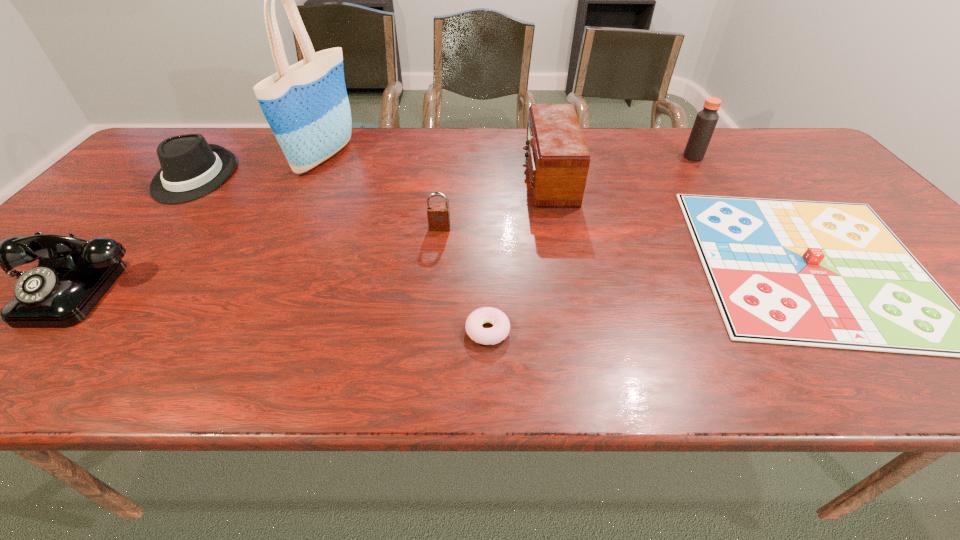
Where is `free space located 0.170m on the front-facing side of the radio receiver`? This screenshot has height=540, width=960. free space located 0.170m on the front-facing side of the radio receiver is located at coordinates (464, 178).

The image size is (960, 540). Identify the location of vacant space situated 0.050m on the front-facing side of the radio receiver. (507, 178).

At what (x,y) coordinates should I click in order to perform the action: click on free location located on the front-facing side of the radio receiver. Please return your answer as a coordinate pair (x, y). This screenshot has height=540, width=960. Looking at the image, I should click on (482, 178).

The width and height of the screenshot is (960, 540). In order to click on free region located 0.060m on the front-facing side of the padlock in this screenshot , I will do [438, 248].

Locate an element on the screen. This screenshot has width=960, height=540. free space located on the front-facing side of the fedora is located at coordinates (114, 272).

I want to click on vacant space positioned 0.300m on the left of the shortest object, so click(x=310, y=330).

The height and width of the screenshot is (540, 960). Find the location of `tote bag present at the far edge`. tote bag present at the far edge is located at coordinates (306, 105).

The width and height of the screenshot is (960, 540). Identify the location of vinegar located at the far edge. (706, 119).

The width and height of the screenshot is (960, 540). Find the location of `radio receiver that is at the far edge`. radio receiver that is at the far edge is located at coordinates (558, 159).

Locate an element on the screen. The height and width of the screenshot is (540, 960). fedora located in the far edge section of the desktop is located at coordinates (191, 168).